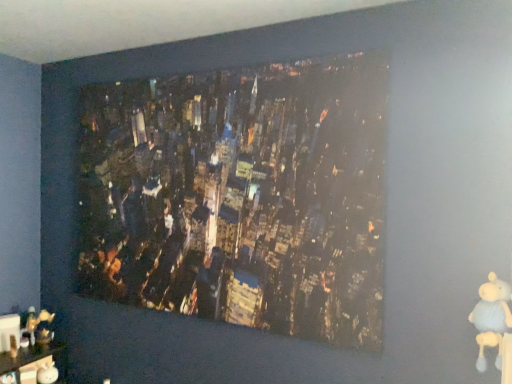
In order to click on white plush bear at lower right in this screenshot , I will do `click(490, 318)`.

What is the approximate height of wooden figurine at lower left?

The height of wooden figurine at lower left is 39.66 centimeters.

What do you see at coordinates (241, 196) in the screenshot?
I see `matte cityscape print at center` at bounding box center [241, 196].

At what (x,y) coordinates should I click in order to perform the action: click on white plush bear at lower right. Please return your answer as a coordinate pair (x, y). The height and width of the screenshot is (384, 512). Looking at the image, I should click on (490, 318).

From the image's perspective, which is above, white plush bear at lower right or matte cityscape print at center?

matte cityscape print at center appears higher in the image.

How many degrees apart are the facing directions of white plush bear at lower right and matte cityscape print at center?

white plush bear at lower right and matte cityscape print at center are facing 36.7 degrees away from each other.

Are white plush bear at lower right and matte cityscape print at center making contact?

No, white plush bear at lower right is not in contact with matte cityscape print at center.

There is a white plush bear at lower right. At what (x,y) coordinates should I click in order to perform the action: click on picture frame above it (from a real-world perspective). Please return your answer as a coordinate pair (x, y). Looking at the image, I should click on (241, 196).

Is white plush bear at lower right facing towards wooden figurine at lower left?

No, white plush bear at lower right is not aimed at wooden figurine at lower left.

In the image, is white plush bear at lower right positioned in front of or behind wooden figurine at lower left?

white plush bear at lower right is in front of wooden figurine at lower left.

From the image's perspective, is white plush bear at lower right under wooden figurine at lower left?

No, from the image's perspective, white plush bear at lower right is not beneath wooden figurine at lower left.

Based on the photo, is wooden figurine at lower left far away from matte cityscape print at center?

That's right, there is a large distance between wooden figurine at lower left and matte cityscape print at center.

Can you confirm if wooden figurine at lower left is thinner than matte cityscape print at center?

Incorrect, the width of wooden figurine at lower left is not less than that of matte cityscape print at center.

From the image's perspective, is wooden figurine at lower left on matte cityscape print at center?

No, from the image's perspective, wooden figurine at lower left is not over matte cityscape print at center.

From the picture: Who is taller, matte cityscape print at center or wooden figurine at lower left?

Standing taller between the two is matte cityscape print at center.

Is matte cityscape print at center oriented towards wooden figurine at lower left?

No, matte cityscape print at center does not turn towards wooden figurine at lower left.

Where is `furniture behind the matte cityscape print at center`? The width and height of the screenshot is (512, 384). furniture behind the matte cityscape print at center is located at coordinates (27, 358).

In the scene shown: Which is in front, matte cityscape print at center or wooden figurine at lower left?

matte cityscape print at center is more forward.

From a real-world perspective, is wooden figurine at lower left under white plush bear at lower right?

Correct, in the physical world, wooden figurine at lower left is lower than white plush bear at lower right.

Considering the sizes of wooden figurine at lower left and white plush bear at lower right in the image, is wooden figurine at lower left wider or thinner than white plush bear at lower right?

Considering their sizes, wooden figurine at lower left looks broader than white plush bear at lower right.

In the scene shown: Is white plush bear at lower right at the back of wooden figurine at lower left?

wooden figurine at lower left is not turned away from white plush bear at lower right.

Is matte cityscape print at center turned away from white plush bear at lower right?

No, matte cityscape print at center is not facing away from white plush bear at lower right.

Which of these two, matte cityscape print at center or white plush bear at lower right, is bigger?

With larger size is matte cityscape print at center.

From the image's perspective, is matte cityscape print at center located beneath white plush bear at lower right?

No, from the image's perspective, matte cityscape print at center is not below white plush bear at lower right.

From the picture: Does matte cityscape print at center have a lesser width compared to white plush bear at lower right?

Indeed, matte cityscape print at center has a lesser width compared to white plush bear at lower right.

At what (x,y) coordinates should I click in order to perform the action: click on toy lying in front of the matte cityscape print at center. Please return your answer as a coordinate pair (x, y). The height and width of the screenshot is (384, 512). Looking at the image, I should click on (490, 318).

Image resolution: width=512 pixels, height=384 pixels. I want to click on furniture below the white plush bear at lower right (from the image's perspective), so click(27, 358).

Looking at the image, which one is located closer to matte cityscape print at center, white plush bear at lower right or wooden figurine at lower left?

white plush bear at lower right lies closer to matte cityscape print at center than the other object.

Looking at the image, which one is located closer to white plush bear at lower right, matte cityscape print at center or wooden figurine at lower left?

The object closer to white plush bear at lower right is matte cityscape print at center.

From the picture: Looking at the image, which one is located further to wooden figurine at lower left, matte cityscape print at center or white plush bear at lower right?

white plush bear at lower right.

From the image, which object appears to be nearer to matte cityscape print at center, wooden figurine at lower left or white plush bear at lower right?

white plush bear at lower right lies closer to matte cityscape print at center than the other object.

Which object lies further to the anchor point white plush bear at lower right, wooden figurine at lower left or matte cityscape print at center?

wooden figurine at lower left is further to white plush bear at lower right.

Looking at the image, which one is located further to wooden figurine at lower left, white plush bear at lower right or matte cityscape print at center?

white plush bear at lower right lies further to wooden figurine at lower left than the other object.

Locate an element on the screen. Image resolution: width=512 pixels, height=384 pixels. picture frame located between wooden figurine at lower left and white plush bear at lower right in the left-right direction is located at coordinates (241, 196).